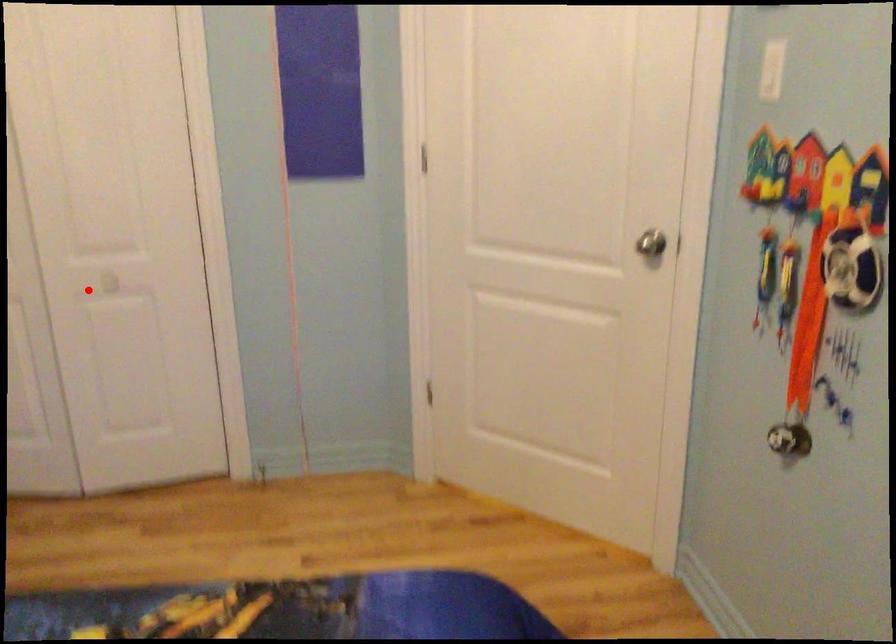
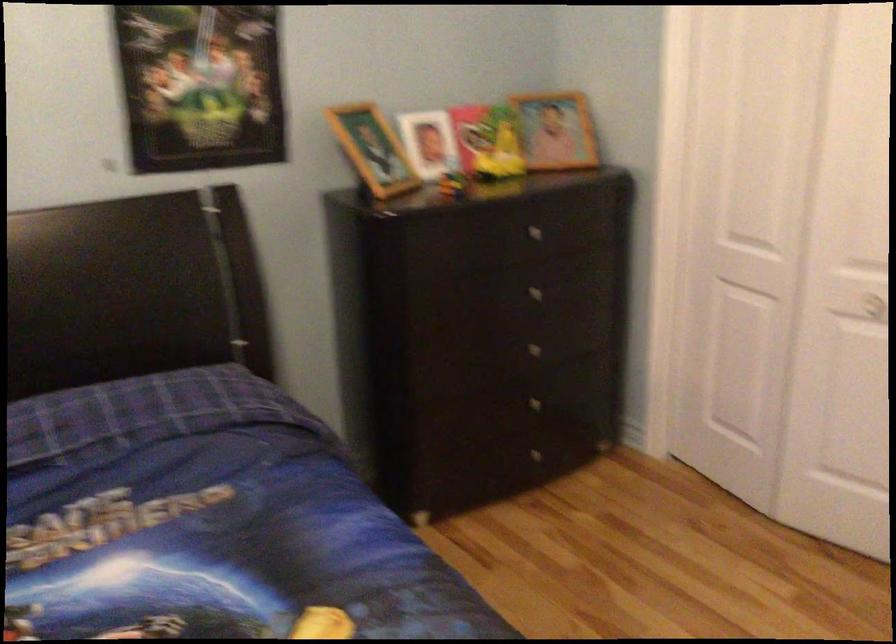
Question: I am providing you with two images of the same scene from different viewpoints. In image1, a red point is highlighted. Considering the same 3D point in image2, which of the following is correct?

Choices:
 (A) It is closer
 (B) It is farther

Answer: (A)